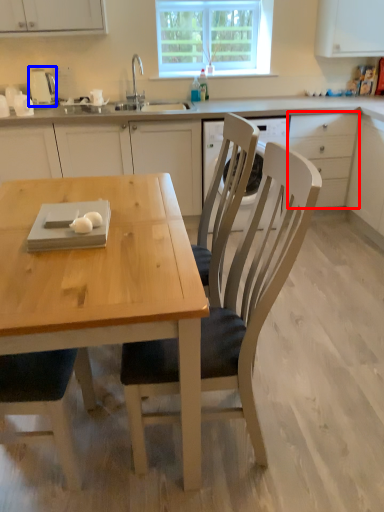
Question: Which point is closer to the camera, drawer (highlighted by a red box) or appliance (highlighted by a blue box)?

Choices:
 (A) drawer
 (B) appliance

Answer: (A)